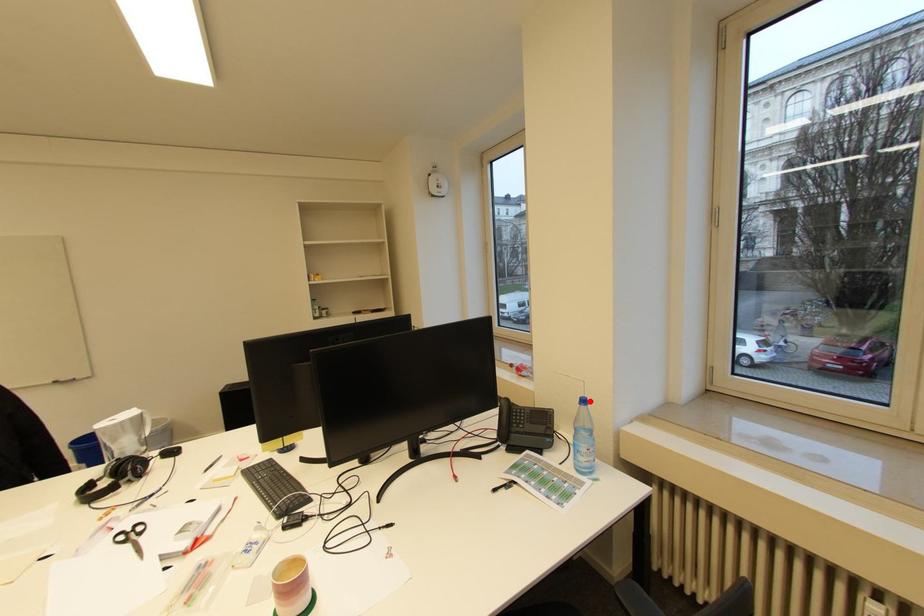
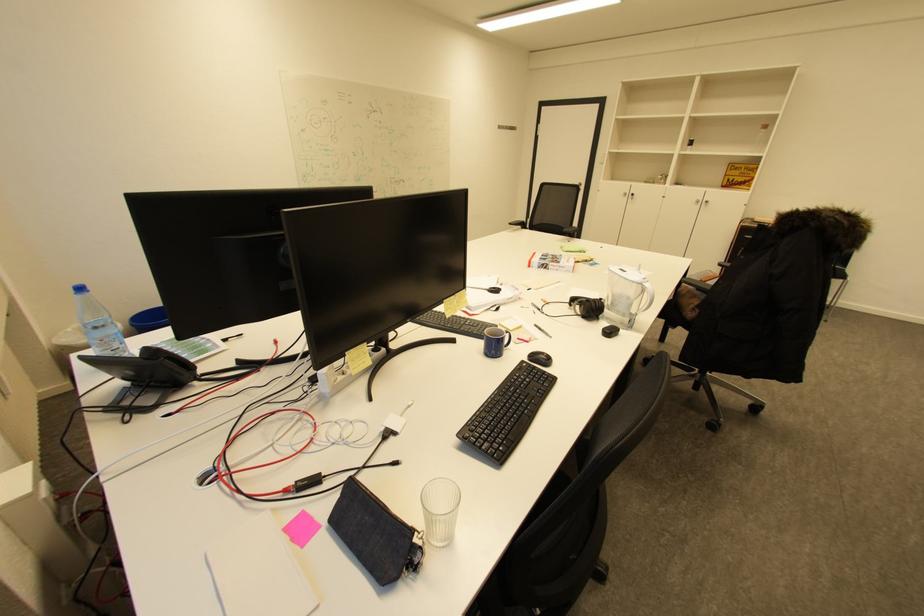
Question: I am providing you with two images of the same scene from different viewpoints. Image1 has a red point marked. In image2, the corresponding 3D location appears at what relative position? Reply with the corresponding letter.

Choices:
 (A) Closer
 (B) Farther

Answer: (A)